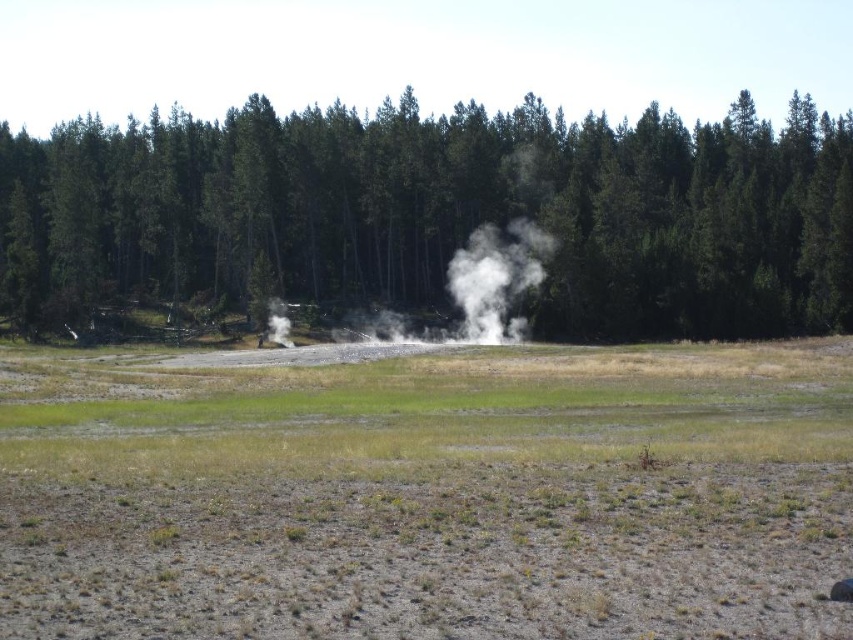
Question: Estimate the real-world distances between objects in this image. Which object is closer to the dried grass at center?

Choices:
 (A) white vapor at center
 (B) green textured trees at center

Answer: (A)

Question: In this image, where is dried grass at center located relative to green textured trees at center?

Choices:
 (A) left
 (B) right

Answer: (A)

Question: Which point is closer to the camera taking this photo?

Choices:
 (A) (392, 419)
 (B) (469, 324)
 (C) (630, 186)

Answer: (A)

Question: Is dried grass at center below green textured trees at center?

Choices:
 (A) yes
 (B) no

Answer: (A)

Question: Does green textured trees at center have a smaller size compared to white vapor at center?

Choices:
 (A) yes
 (B) no

Answer: (B)

Question: Estimate the real-world distances between objects in this image. Which object is farther from the white vapor at center?

Choices:
 (A) dried grass at center
 (B) green textured trees at center

Answer: (A)